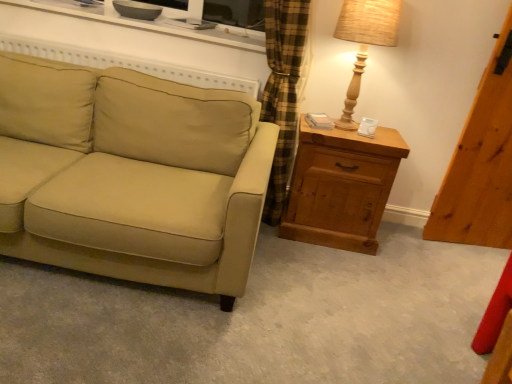
Describe the element at coordinates (341, 187) in the screenshot. The width and height of the screenshot is (512, 384). I see `wooden chest of drawers at right` at that location.

What are the coordinates of `wooden table lamp at right` in the screenshot? It's located at (364, 41).

Between white glossy entertainment center at upper center and wooden chest of drawers at right, which one has larger size?

wooden chest of drawers at right is bigger.

Between white glossy entertainment center at upper center and wooden chest of drawers at right, which one is positioned in front?

Positioned in front is wooden chest of drawers at right.

Locate an element on the screen. the chest of drawers below the white glossy entertainment center at upper center (from a real-world perspective) is located at coordinates (341, 187).

In the image, is white glossy entertainment center at upper center on the left side or the right side of wooden chest of drawers at right?

In the image, white glossy entertainment center at upper center appears on the left side of wooden chest of drawers at right.

Is wooden table lamp at right inside or outside of beige fabric couch at left?

wooden table lamp at right lies outside beige fabric couch at left.

Considering the relative sizes of wooden table lamp at right and beige fabric couch at left in the image provided, is wooden table lamp at right thinner than beige fabric couch at left?

Indeed, wooden table lamp at right has a lesser width compared to beige fabric couch at left.

Is wooden table lamp at right aimed at beige fabric couch at left?

No, wooden table lamp at right is not facing towards beige fabric couch at left.

Is wooden table lamp at right bigger than beige fabric couch at left?

Actually, wooden table lamp at right might be smaller than beige fabric couch at left.

The height and width of the screenshot is (384, 512). I want to click on table lamp that appears above the wooden chest of drawers at right (from the image's perspective), so click(x=364, y=41).

Is wooden chest of drawers at right with wooden table lamp at right?

No, wooden chest of drawers at right is not making contact with wooden table lamp at right.

Which is less distant, (380, 173) or (378, 33)?

Point (380, 173) is farther from the camera than point (378, 33).

How different are the orientations of wooden chest of drawers at right and wooden table lamp at right in degrees?

The angle between the facing direction of wooden chest of drawers at right and the facing direction of wooden table lamp at right is 0.634 degrees.

From a real-world perspective, is wooden chest of drawers at right below white glossy entertainment center at upper center?

Yes, from a real-world perspective, wooden chest of drawers at right is below white glossy entertainment center at upper center.

Which of these two, wooden chest of drawers at right or white glossy entertainment center at upper center, is thinner?

wooden chest of drawers at right.

Based on the photo, considering the positions of objects wooden chest of drawers at right and white glossy entertainment center at upper center in the image provided, who is more to the right, wooden chest of drawers at right or white glossy entertainment center at upper center?

wooden chest of drawers at right is more to the right.

Are wooden chest of drawers at right and white glossy entertainment center at upper center located far from each other?

wooden chest of drawers at right is near white glossy entertainment center at upper center, not far away.

Considering the positions of objects white glossy entertainment center at upper center and wooden table lamp at right in the image provided, who is more to the left, white glossy entertainment center at upper center or wooden table lamp at right?

white glossy entertainment center at upper center is more to the left.

Does white glossy entertainment center at upper center turn towards wooden table lamp at right?

No, white glossy entertainment center at upper center does not turn towards wooden table lamp at right.

Is white glossy entertainment center at upper center taller than wooden table lamp at right?

No.

Is wooden table lamp at right looking in the opposite direction of white glossy entertainment center at upper center?

No, wooden table lamp at right is not facing away from white glossy entertainment center at upper center.

Considering the sizes of objects wooden table lamp at right and white glossy entertainment center at upper center in the image provided, who is shorter, wooden table lamp at right or white glossy entertainment center at upper center?

white glossy entertainment center at upper center is shorter.

From a real-world perspective, is wooden table lamp at right under white glossy entertainment center at upper center?

Incorrect, from a real-world perspective, wooden table lamp at right is higher than white glossy entertainment center at upper center.

Is wooden table lamp at right to the left or to the right of white glossy entertainment center at upper center in the image?

→ From the image, it's evident that wooden table lamp at right is to the right of white glossy entertainment center at upper center.

Between beige fabric couch at left and wooden chest of drawers at right, which one appears on the left side from the viewer's perspective?

From the viewer's perspective, beige fabric couch at left appears more on the left side.

From the image's perspective, is beige fabric couch at left located beneath wooden chest of drawers at right?

Actually, beige fabric couch at left appears above wooden chest of drawers at right in the image.

Is beige fabric couch at left positioned far away from wooden chest of drawers at right?

beige fabric couch at left is actually quite close to wooden chest of drawers at right.

Consider the image. Can you confirm if beige fabric couch at left is thinner than wooden chest of drawers at right?

No.

Image resolution: width=512 pixels, height=384 pixels. Identify the location of entertainment center behind the wooden chest of drawers at right. (147, 24).

You are a GUI agent. You are given a task and a screenshot of the screen. Output one action in this format:
    pyautogui.click(x=<x>, y=<y>)
    Task: Click on the table lamp that appears above the beige fabric couch at left (from the image's perspective)
    
    Given the screenshot: What is the action you would take?
    pyautogui.click(x=364, y=41)

Which object lies nearer to the anchor point wooden table lamp at right, beige fabric couch at left or white glossy entertainment center at upper center?

white glossy entertainment center at upper center lies closer to wooden table lamp at right than the other object.

From the picture: Estimate the real-world distances between objects in this image. Which object is closer to wooden chest of drawers at right, beige fabric couch at left or white glossy entertainment center at upper center?

beige fabric couch at left is positioned closer to the anchor wooden chest of drawers at right.

Which object lies nearer to the anchor point beige fabric couch at left, wooden table lamp at right or wooden chest of drawers at right?

wooden chest of drawers at right.

Based on their spatial positions, is beige fabric couch at left or wooden table lamp at right further from white glossy entertainment center at upper center?

Among the two, beige fabric couch at left is located further to white glossy entertainment center at upper center.

In the scene shown: Considering their positions, is beige fabric couch at left positioned further to wooden table lamp at right than wooden chest of drawers at right?

The object further to wooden table lamp at right is beige fabric couch at left.

When comparing their distances from beige fabric couch at left, does wooden chest of drawers at right or white glossy entertainment center at upper center seem further?

white glossy entertainment center at upper center.

Considering their positions, is wooden table lamp at right positioned further to beige fabric couch at left than white glossy entertainment center at upper center?

wooden table lamp at right lies further to beige fabric couch at left than the other object.

Which object lies nearer to the anchor point white glossy entertainment center at upper center, beige fabric couch at left or wooden chest of drawers at right?

Based on the image, wooden chest of drawers at right appears to be nearer to white glossy entertainment center at upper center.

The width and height of the screenshot is (512, 384). I want to click on the chest of drawers located between white glossy entertainment center at upper center and wooden table lamp at right in the left-right direction, so click(341, 187).

Find the location of a particular element. The height and width of the screenshot is (384, 512). the chest of drawers located between beige fabric couch at left and wooden table lamp at right in the left-right direction is located at coordinates (341, 187).

Locate an element on the screen. The image size is (512, 384). entertainment center between beige fabric couch at left and wooden table lamp at right from left to right is located at coordinates (147, 24).

You are a GUI agent. You are given a task and a screenshot of the screen. Output one action in this format:
    pyautogui.click(x=<x>, y=<y>)
    Task: Click on the entertainment center between beige fabric couch at left and wooden chest of drawers at right in the horizontal direction
    The height and width of the screenshot is (384, 512).
    Given the screenshot: What is the action you would take?
    pyautogui.click(x=147, y=24)